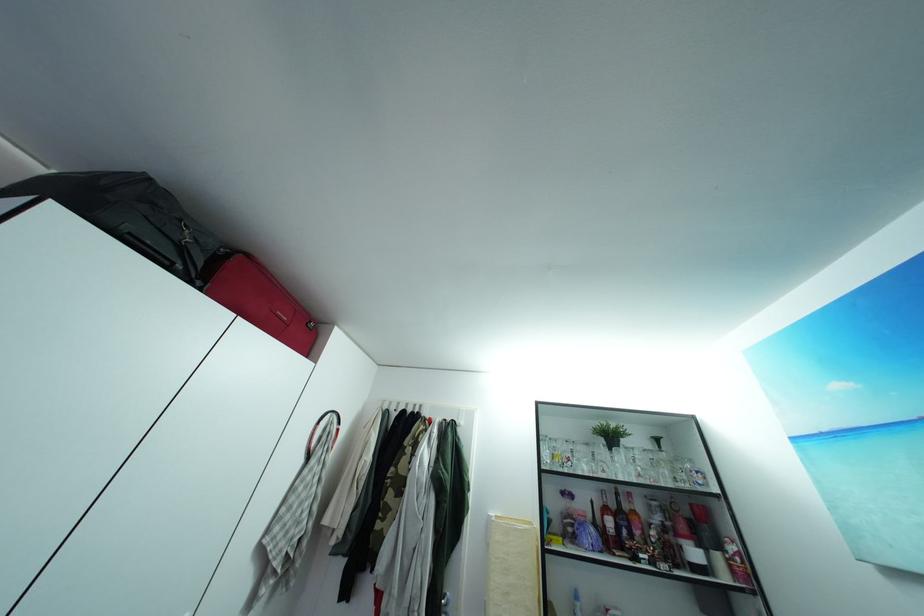
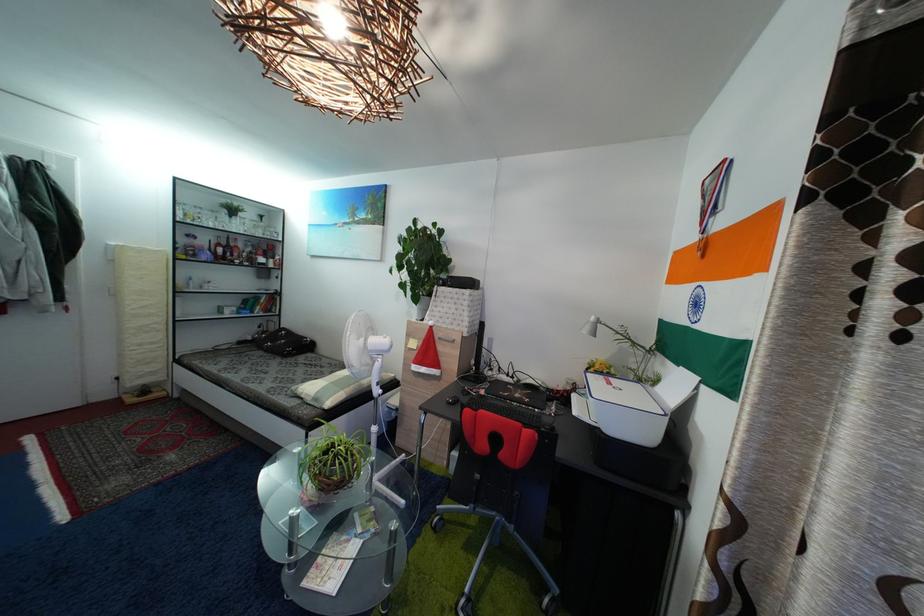
In the second image, find the point that corresponds to point (658, 453) in the first image.

(264, 225)